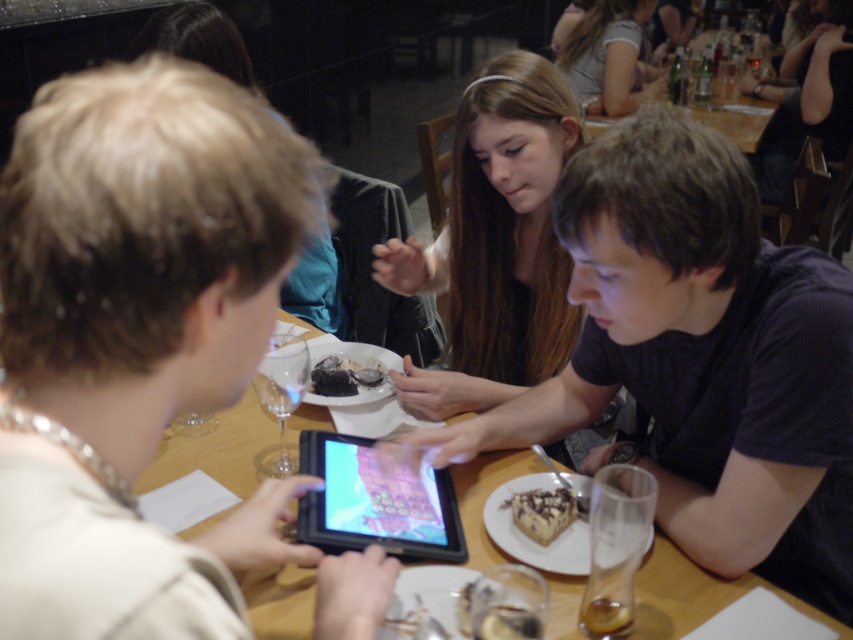
Question: Does striped cotton shirt at upper center come behind chocolate frosted cake at lower center?

Choices:
 (A) no
 (B) yes

Answer: (B)

Question: Based on their relative distances, which object is nearer to the chocolate frosted cake at lower center?

Choices:
 (A) black glossy tablet at center
 (B) striped cotton shirt at upper center
 (C) dark blue t-shirt at center

Answer: (A)

Question: Which object is farther from the camera taking this photo?

Choices:
 (A) chocolate cake with frosting at center
 (B) smooth black shirt at center
 (C) chocolate frosted cake at lower center

Answer: (A)

Question: Does smooth black shirt at center appear over wooden table at center?

Choices:
 (A) no
 (B) yes

Answer: (B)

Question: Does smooth black shirt at center appear over chocolate cake with frosting at center?

Choices:
 (A) no
 (B) yes

Answer: (B)

Question: Which of these objects is positioned farthest from the wooden table at center?

Choices:
 (A) black glossy tablet at center
 (B) striped cotton shirt at upper center

Answer: (B)